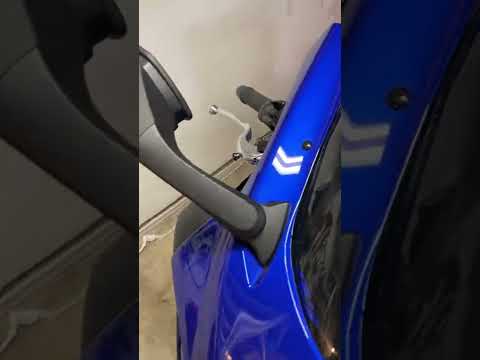
Locate an element on the screen. Image resolution: width=480 pixels, height=360 pixels. small seam near top of mirror is located at coordinates (146, 128).